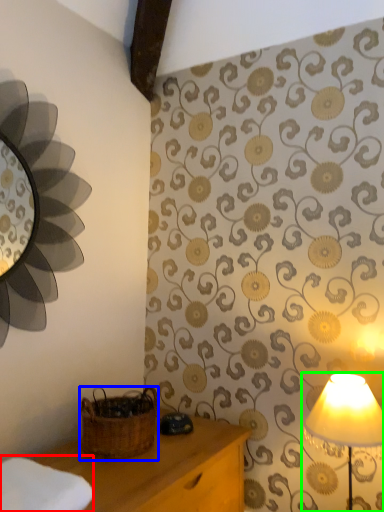
Question: Considering the real-world distances, which object is farthest from cloth (highlighted by a red box)? basket (highlighted by a blue box) or lamp (highlighted by a green box)?

Choices:
 (A) basket
 (B) lamp

Answer: (B)